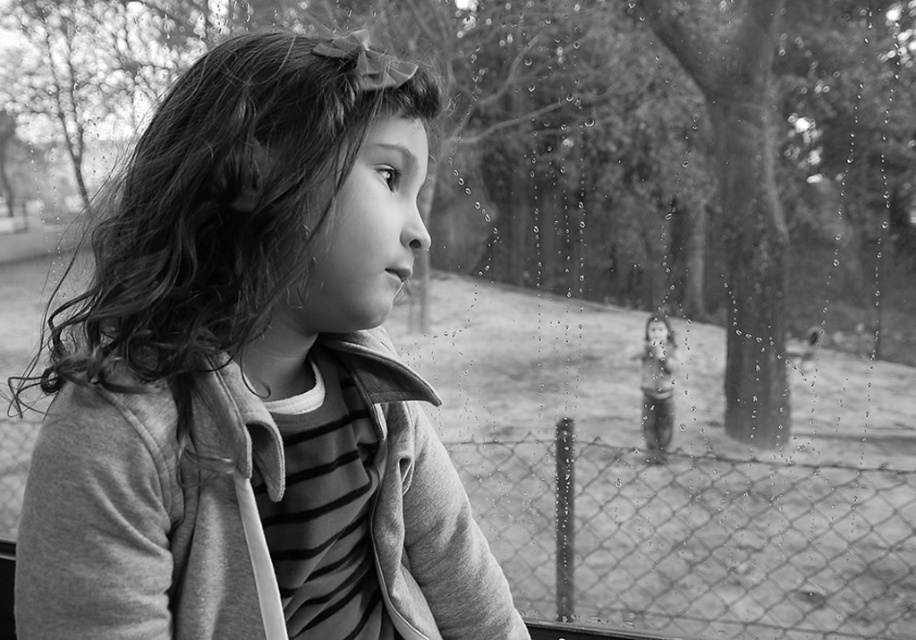
Based on the scene description, if the soft fabric girl at left wants to reach the wire mesh fence at lower center, which direction should she move towards?

The soft fabric girl at left is above the wire mesh fence at lower center, so she should move downward to reach it.

You are an interior designer assessing the layout of the room. The soft fabric girl at left and the wire mesh fence at lower center are part of the decor. Which object takes up more visual space in the composition?

The wire mesh fence at lower center occupies more visual space than the soft fabric girl at left according to the description.